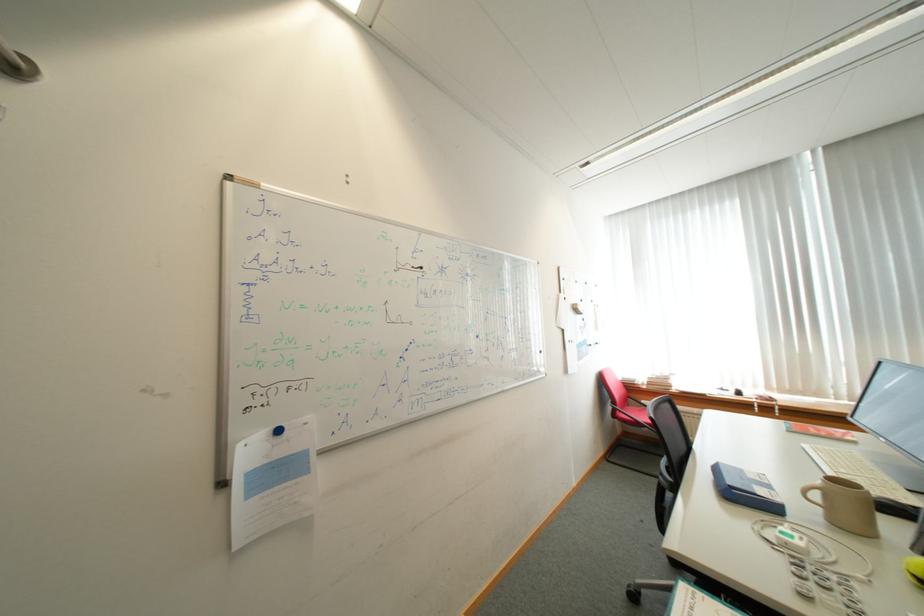
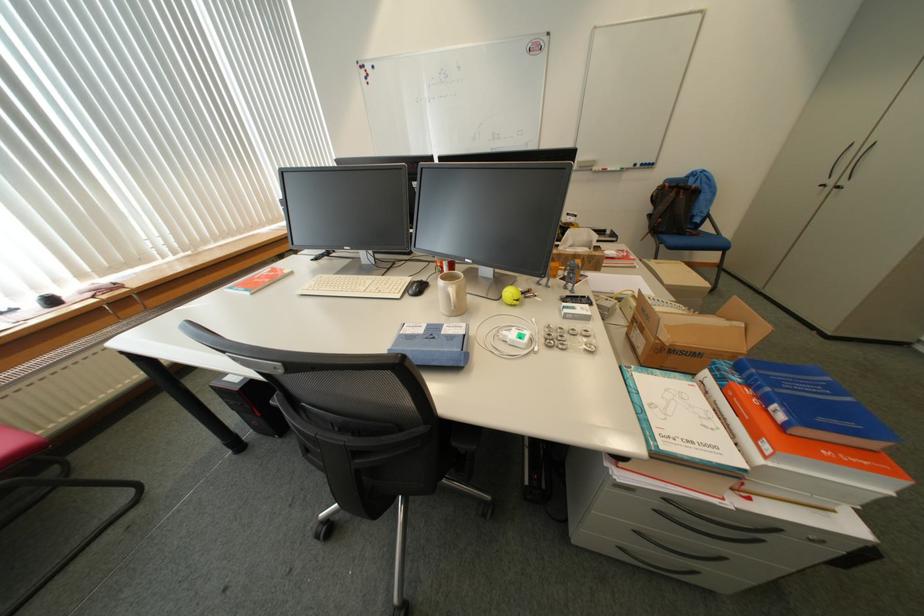
The point at (799, 520) is marked in the first image. Where is the corresponding point in the second image?

(481, 334)